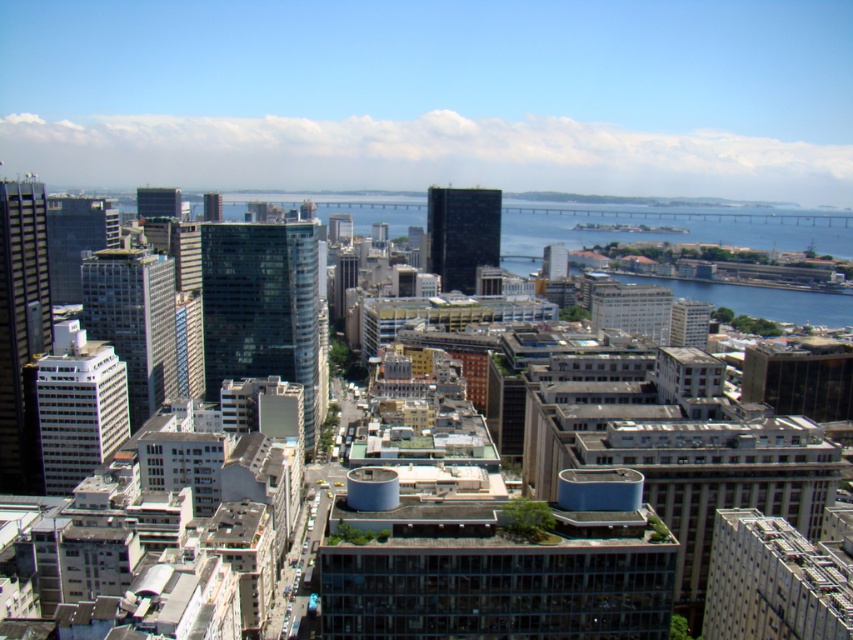
You are an urban planner assessing the city layout. You need to determine if the matte glass tower at upper left can accommodate more floor space than the matte glass skyscraper at center based on their widths. Which building has a greater width?

The matte glass tower at upper left might be wider than the matte glass skyscraper at center, so it could potentially accommodate more floor space depending on its height and other factors.